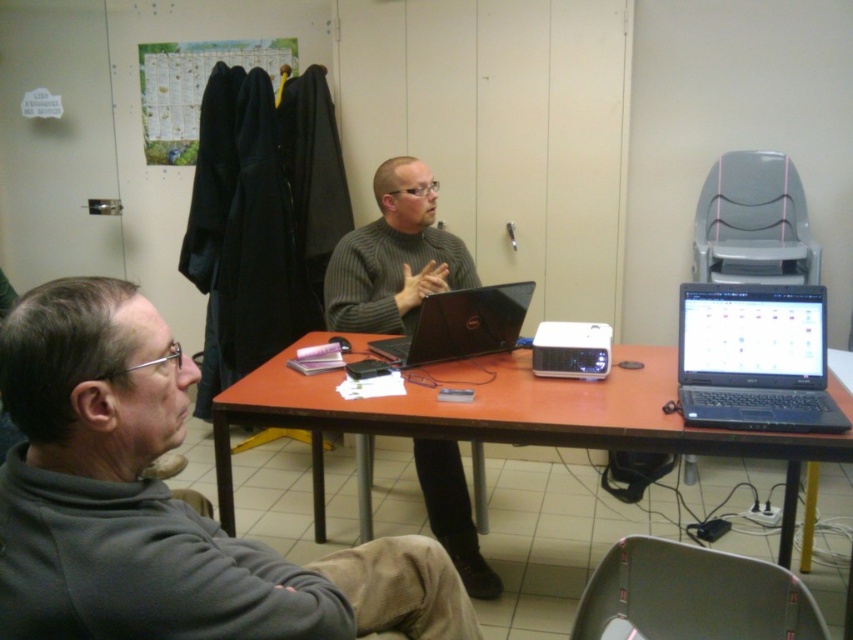
Question: Which point appears closest to the camera in this image?

Choices:
 (A) (320, 337)
 (B) (715, 307)
 (C) (587, 604)
 (D) (573, 346)

Answer: (C)

Question: Is gray fleece jacket at lower left above black matte laptop at right?

Choices:
 (A) no
 (B) yes

Answer: (A)

Question: Is gray fleece jacket at lower left closer to the viewer compared to dull black laptop at center?

Choices:
 (A) yes
 (B) no

Answer: (A)

Question: Which point is closer to the camera taking this photo?

Choices:
 (A) (590, 380)
 (B) (811, 424)

Answer: (B)

Question: Which object is closer to the camera taking this photo?

Choices:
 (A) brown wooden table at center
 (B) black matte laptop at right

Answer: (B)

Question: Is dull black laptop at center behind white plastic projector at center?

Choices:
 (A) no
 (B) yes

Answer: (A)